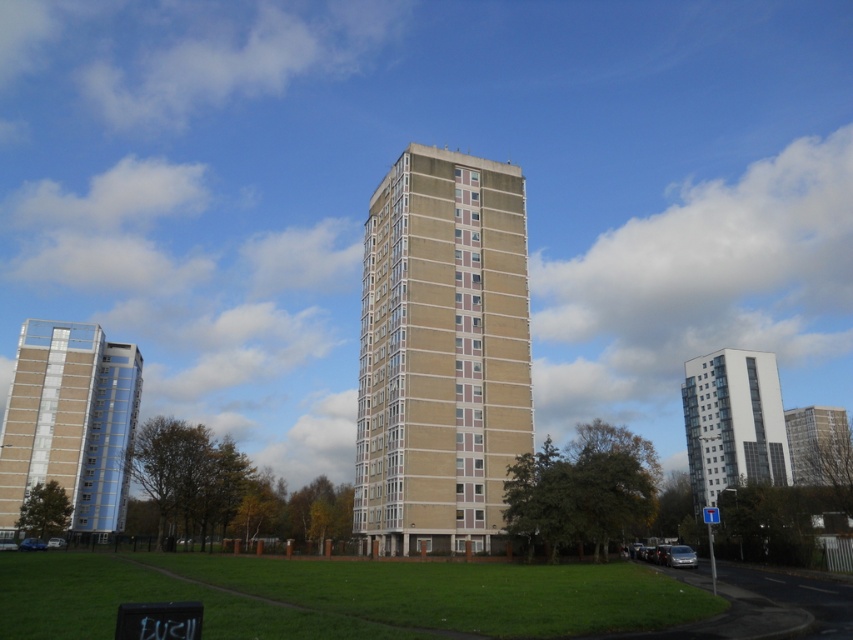
Question: Does beige concrete tower at center have a greater width compared to white glass building at upper center?

Choices:
 (A) yes
 (B) no

Answer: (B)

Question: Which object appears closest to the camera in this image?

Choices:
 (A) metallic glass tower at left
 (B) white glass building at upper center

Answer: (A)

Question: Which object is the closest to the beige concrete tower at center?

Choices:
 (A) metallic glass tower at left
 (B) white glass building at upper center

Answer: (A)

Question: Estimate the real-world distances between objects in this image. Which object is farther from the metallic glass tower at left?

Choices:
 (A) beige concrete tower at center
 (B) white glass building at upper center

Answer: (B)

Question: Considering the relative positions of beige concrete tower at center and metallic glass tower at left in the image provided, where is beige concrete tower at center located with respect to metallic glass tower at left?

Choices:
 (A) right
 (B) left

Answer: (A)

Question: Does metallic glass tower at left appear under white glass building at upper center?

Choices:
 (A) yes
 (B) no

Answer: (B)